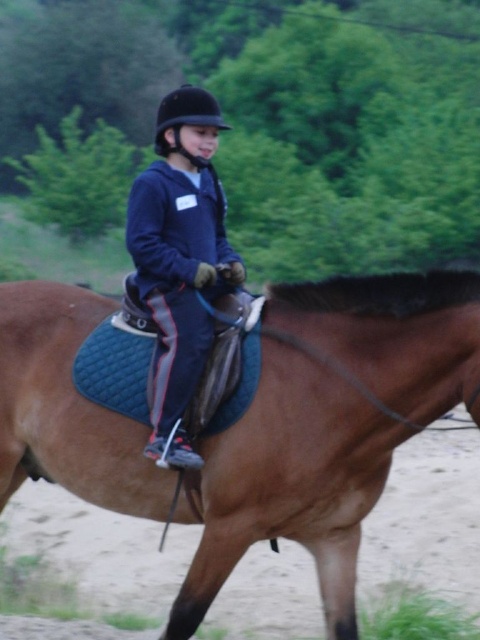
Can you confirm if dark blue fleece jacket at center is smaller than black matte helmet at center?

No, dark blue fleece jacket at center is not smaller than black matte helmet at center.

Who is positioned more to the right, dark blue fleece jacket at center or black matte helmet at center?

dark blue fleece jacket at center is more to the right.

Describe the element at coordinates (180, 259) in the screenshot. I see `dark blue fleece jacket at center` at that location.

The width and height of the screenshot is (480, 640). I want to click on dark blue fleece jacket at center, so click(180, 259).

Is brown leather saddle at center thinner than dark blue fleece jacket at center?

Incorrect, brown leather saddle at center's width is not less than dark blue fleece jacket at center's.

Which of these two, brown leather saddle at center or dark blue fleece jacket at center, stands taller?

dark blue fleece jacket at center

Locate an element on the screen. brown leather saddle at center is located at coordinates (328, 426).

I want to click on brown leather saddle at center, so click(328, 426).

Who is positioned more to the left, brown leather saddle at center or black matte helmet at center?

black matte helmet at center

Between point (424, 346) and point (186, 120), which one is positioned in front?

Point (424, 346) is in front.

Which is in front, point (256, 442) or point (187, 93)?

Point (256, 442)

You are a GUI agent. You are given a task and a screenshot of the screen. Output one action in this format:
    pyautogui.click(x=<x>, y=<y>)
    Task: Click on the brown leather saddle at center
    This screenshot has height=640, width=480.
    Given the screenshot: What is the action you would take?
    pyautogui.click(x=328, y=426)